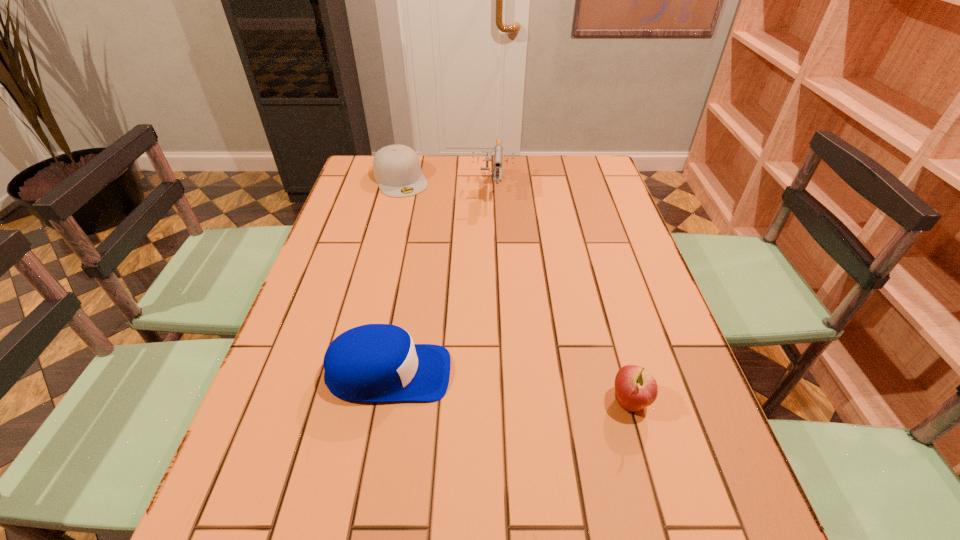
Locate an element on the screen. Image resolution: width=960 pixels, height=540 pixels. free region located 0.340m at the barrel end of the tallest object is located at coordinates (488, 278).

At what (x,y) coordinates should I click in order to perform the action: click on vacant point located at the barrel end of the tallest object. Please return your answer as a coordinate pair (x, y). Image resolution: width=960 pixels, height=540 pixels. Looking at the image, I should click on (491, 224).

You are a GUI agent. You are given a task and a screenshot of the screen. Output one action in this format:
    pyautogui.click(x=<x>, y=<y>)
    Task: Click on the free space located at the barrel end of the tallest object
    
    Given the screenshot: What is the action you would take?
    pyautogui.click(x=488, y=281)

Where is `cap positioned at the far edge`? Image resolution: width=960 pixels, height=540 pixels. cap positioned at the far edge is located at coordinates (397, 169).

You are a GUI agent. You are given a task and a screenshot of the screen. Output one action in this format:
    pyautogui.click(x=<x>, y=<y>)
    Task: Click on the gun that is positioned at the far edge
    The height and width of the screenshot is (540, 960).
    Given the screenshot: What is the action you would take?
    pyautogui.click(x=497, y=176)

At what (x,y) coordinates should I click in order to perform the action: click on baseball cap present at the left edge. Please return your answer as a coordinate pair (x, y). This screenshot has height=540, width=960. Looking at the image, I should click on (374, 362).

You are a GUI agent. You are given a task and a screenshot of the screen. Output one action in this format:
    pyautogui.click(x=<x>, y=<y>)
    Task: Click on the cap positioned at the left edge
    This screenshot has width=960, height=540.
    Given the screenshot: What is the action you would take?
    pyautogui.click(x=397, y=169)

You are a GUI agent. You are given a task and a screenshot of the screen. Output one action in this format:
    pyautogui.click(x=<x>, y=<y>)
    Task: Click on the object located in the right edge section of the desktop
    Image resolution: width=960 pixels, height=540 pixels.
    Given the screenshot: What is the action you would take?
    pyautogui.click(x=635, y=388)

The image size is (960, 540). I want to click on object present at the far left corner, so click(x=397, y=169).

Locate an element on the screen. vacant point at the far edge is located at coordinates (458, 172).